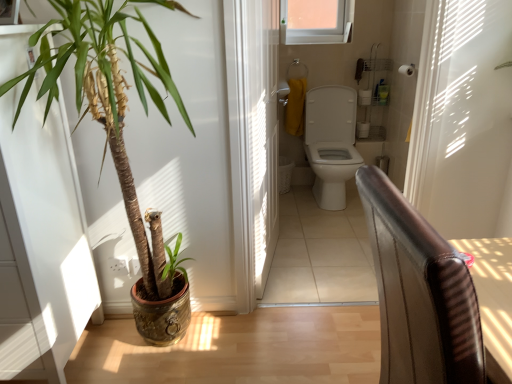
Locate an element on the screen. The image size is (512, 384). transparent glass window at upper center is located at coordinates (316, 21).

I want to click on green leafy plant at left, so click(108, 97).

Find the location of `brown leather chair at right`. brown leather chair at right is located at coordinates (420, 293).

The image size is (512, 384). What do you see at coordinates (331, 142) in the screenshot? I see `white glossy toilet at center` at bounding box center [331, 142].

What do you see at coordinates (259, 135) in the screenshot? I see `translucent plastic screen door at center` at bounding box center [259, 135].

Where is `white glossy toilet at center, the 1th path positioned from the top`? This screenshot has width=512, height=384. white glossy toilet at center, the 1th path positioned from the top is located at coordinates (320, 253).

Is wooden floor at lower left, marked as the 1th path in a bottom-to-top arrangement, directly adjacent to translucent plastic screen door at center?

wooden floor at lower left, marked as the 1th path in a bottom-to-top arrangement, and translucent plastic screen door at center are not in contact.

Is wooden floor at lower left, the second path positioned from the top, taller than translucent plastic screen door at center?

No.

From the image's perspective, between wooden floor at lower left, which ranks as the second path in back-to-front order, and translucent plastic screen door at center, which one is located above?

translucent plastic screen door at center, from the image's perspective.

From a real-world perspective, is wooden floor at lower left, marked as the 1th path in a bottom-to-top arrangement, on top of translucent plastic screen door at center?

Actually, wooden floor at lower left, marked as the 1th path in a bottom-to-top arrangement, is physically below translucent plastic screen door at center in the real world.

Could you tell me if wooden floor at lower left, which ranks as the second path in back-to-front order, is turned towards white glossy toilet at center?

No, wooden floor at lower left, which ranks as the second path in back-to-front order, is not aimed at white glossy toilet at center.

Looking at this image, which of these two, wooden floor at lower left, marked as the 1th path in a bottom-to-top arrangement, or white glossy toilet at center, is bigger?

With larger size is white glossy toilet at center.

Does point (352, 334) come farther from viewer compared to point (320, 93)?

No, it is in front of (320, 93).

Does wooden floor at lower left, which ranks as the second path in back-to-front order, contain white glossy toilet at center?

No, white glossy toilet at center is not inside wooden floor at lower left, which ranks as the second path in back-to-front order.

Which object is positioned more to the left, wooden floor at lower left, which ranks as the second path in back-to-front order, or white plastic towel bar at upper center?

From the viewer's perspective, wooden floor at lower left, which ranks as the second path in back-to-front order, appears more on the left side.

From the image's perspective, does wooden floor at lower left, the second path positioned from the top, appear higher than white plastic towel bar at upper center?

Actually, wooden floor at lower left, the second path positioned from the top, appears below white plastic towel bar at upper center in the image.

Can you confirm if wooden floor at lower left, the second path positioned from the top, is shorter than white plastic towel bar at upper center?

Correct, wooden floor at lower left, the second path positioned from the top, is not as tall as white plastic towel bar at upper center.

From the picture: Would you say wooden floor at lower left, the second path positioned from the top, contains white plastic towel bar at upper center?

No, white plastic towel bar at upper center is not inside wooden floor at lower left, the second path positioned from the top.

From a real-world perspective, is white glossy toilet at center, acting as the first path starting from the back, positioned under wooden floor at lower left, the second path positioned from the top, based on gravity?

Indeed, from a real-world perspective, white glossy toilet at center, acting as the first path starting from the back, is positioned beneath wooden floor at lower left, the second path positioned from the top.

Is white glossy toilet at center, which appears as the second path when viewed from the front, directly adjacent to wooden floor at lower left, the second path positioned from the top?

white glossy toilet at center, which appears as the second path when viewed from the front, and wooden floor at lower left, the second path positioned from the top, are not in contact.

Could you tell me if white glossy toilet at center, the 1th path positioned from the top, is turned towards wooden floor at lower left, which is the first path from front to back?

Yes, white glossy toilet at center, the 1th path positioned from the top, is facing wooden floor at lower left, which is the first path from front to back.

Considering the sizes of objects white glossy toilet at center, acting as the first path starting from the back, and wooden floor at lower left, which is the first path from front to back, in the image provided, who is taller, white glossy toilet at center, acting as the first path starting from the back, or wooden floor at lower left, which is the first path from front to back,?

Standing taller between the two is wooden floor at lower left, which is the first path from front to back.

How many degrees apart are the facing directions of brown leather chair at right and white glossy toilet at center?

They differ by 94.7 degrees in their facing directions.

Is brown leather chair at right situated inside white glossy toilet at center or outside?

brown leather chair at right is located beyond the bounds of white glossy toilet at center.

From the image's perspective, is brown leather chair at right above or below white glossy toilet at center?

Clearly, from the image's perspective, brown leather chair at right is below white glossy toilet at center.

Locate an element on the screen. Image resolution: width=512 pixels, height=384 pixels. chair in front of the white glossy toilet at center is located at coordinates (420, 293).

Can you confirm if white glossy toilet at center is wider than brown leather chair at right?

Yes, white glossy toilet at center is wider than brown leather chair at right.

Relative to brown leather chair at right, is white glossy toilet at center in front or behind?

white glossy toilet at center is behind brown leather chair at right.

From a real-world perspective, which object stands above the other?

brown leather chair at right, from a real-world perspective.

Considering the points (334, 207) and (417, 217), which point is behind, point (334, 207) or point (417, 217)?

The point (334, 207) is farther from the camera.

What's the angular difference between white glossy toilet at center and wooden floor at lower left, which is the first path from front to back,'s facing directions?

The facing directions of white glossy toilet at center and wooden floor at lower left, which is the first path from front to back, are 86.6 degrees apart.

Image resolution: width=512 pixels, height=384 pixels. Identify the location of the 2nd path below the white glossy toilet at center (from the image's perspective). (238, 349).

Is point (350, 169) farther from viewer compared to point (337, 328)?

Yes, point (350, 169) is behind point (337, 328).

From a real-world perspective, does white glossy toilet at center sit lower than wooden floor at lower left, which is the first path from front to back?

Incorrect, from a real-world perspective, white glossy toilet at center is higher than wooden floor at lower left, which is the first path from front to back.

In order to click on path located on the left of translucent plastic screen door at center in this screenshot , I will do `click(238, 349)`.

The height and width of the screenshot is (384, 512). I want to click on path that is the 2nd one when counting forward from the white glossy toilet at center, so click(238, 349).

In the scene shown: Estimate the real-world distances between objects in this image. Which object is further from white glossy toilet at center, green leafy plant at left or white glossy toilet at center, the 2th path positioned from the bottom?

Among the two, green leafy plant at left is located further to white glossy toilet at center.

Looking at this image, estimate the real-world distances between objects in this image. Which object is further from brown leather chair at right, transparent glass window at upper center or translucent plastic screen door at center?

Among the two, transparent glass window at upper center is located further to brown leather chair at right.

Based on their spatial positions, is green leafy plant at left or white plastic towel bar at upper center closer to translucent plastic screen door at center?

Based on the image, green leafy plant at left appears to be nearer to translucent plastic screen door at center.

Looking at the image, which one is located further to white glossy toilet at center, the 2th path positioned from the bottom, wooden floor at lower left, which ranks as the second path in back-to-front order, or transparent glass window at upper center?

Based on the image, transparent glass window at upper center appears to be further to white glossy toilet at center, the 2th path positioned from the bottom.

When comparing their distances from green leafy plant at left, does white plastic towel bar at upper center or white glossy toilet at center seem closer?

The object closer to green leafy plant at left is white glossy toilet at center.

Looking at the image, which one is located further to transparent glass window at upper center, wooden floor at lower left, which is the first path from front to back, or white glossy toilet at center?

wooden floor at lower left, which is the first path from front to back.

From the image, which object appears to be farther from translucent plastic screen door at center, transparent glass window at upper center or brown leather chair at right?

Based on the image, transparent glass window at upper center appears to be further to translucent plastic screen door at center.

When comparing their distances from translucent plastic screen door at center, does white glossy toilet at center, acting as the first path starting from the back, or brown leather chair at right seem further?

Based on the image, brown leather chair at right appears to be further to translucent plastic screen door at center.

Identify the location of towel bar between translucent plastic screen door at center and transparent glass window at upper center along the z-axis. (407, 70).

What are the coordinates of `houseplant located between brown leather chair at right and white glossy toilet at center, the 2th path positioned from the bottom, in the depth direction` in the screenshot? It's located at (108, 97).

The width and height of the screenshot is (512, 384). Find the location of `path between green leafy plant at left and white glossy toilet at center, the 2th path positioned from the bottom, from front to back`. path between green leafy plant at left and white glossy toilet at center, the 2th path positioned from the bottom, from front to back is located at coordinates (238, 349).

Find the location of a particular element. The height and width of the screenshot is (384, 512). screen door located between green leafy plant at left and white glossy toilet at center in the depth direction is located at coordinates (259, 135).